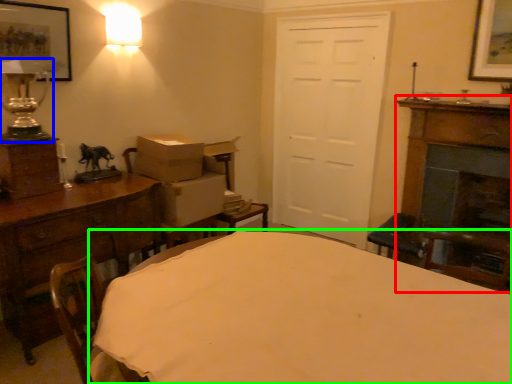
Question: Which object is positioned farthest from fireplace (highlighted by a red box)? Select from table lamp (highlighted by a blue box) and table (highlighted by a green box).

Choices:
 (A) table lamp
 (B) table

Answer: (A)